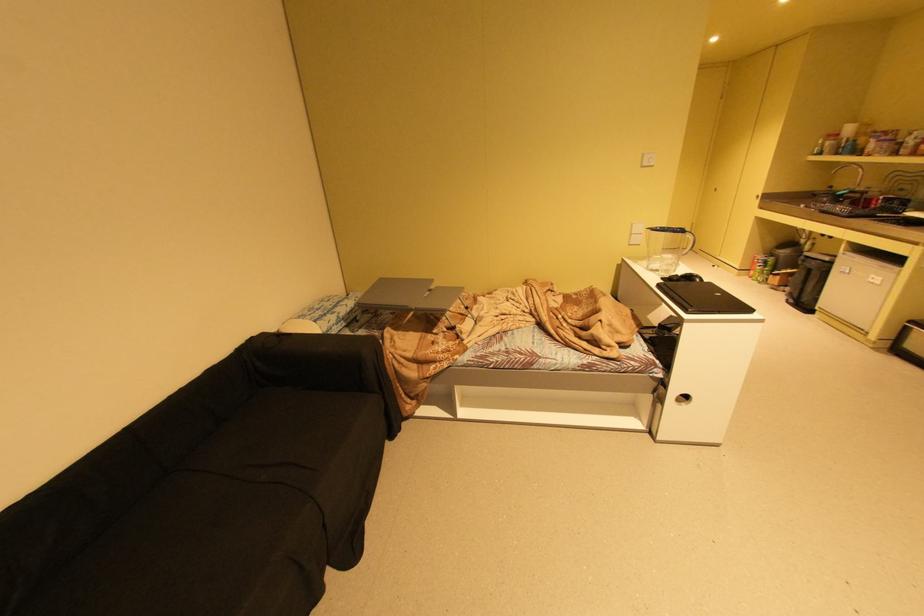
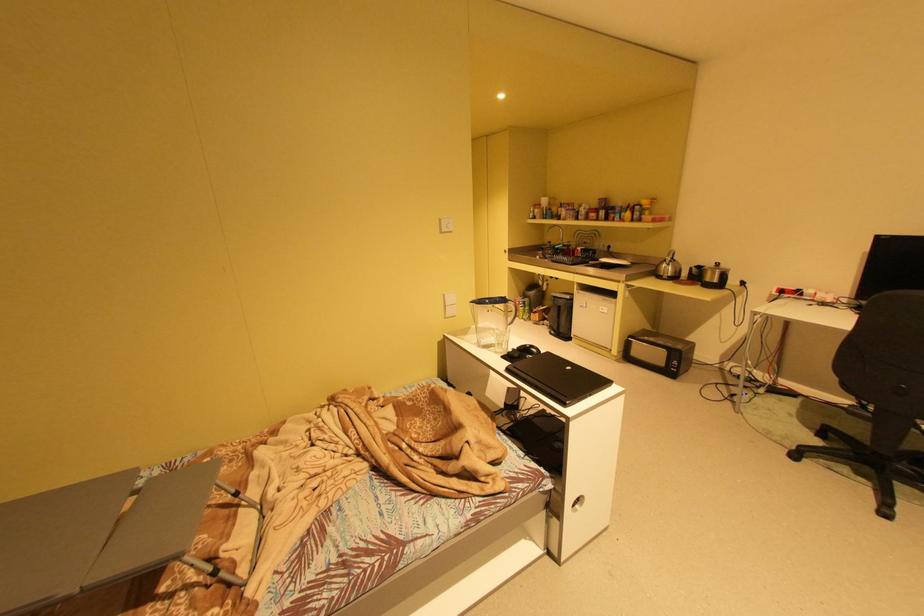
Question: How did the camera likely rotate?

Choices:
 (A) Left
 (B) Right
 (C) Up
 (D) Down

Answer: (B)